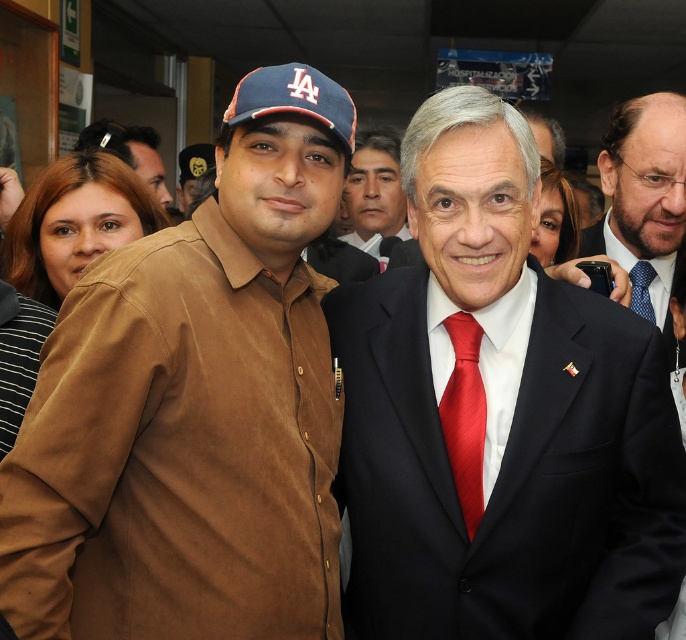
You are a photographer trying to adjust the lighting for a group photo. You notice the matte black suit at center and the smooth skin face at center. Which object requires more light to ensure proper exposure?

The smooth skin face at center requires more light because it occupies more space than the matte black suit at center, so it needs adequate lighting to capture details properly.